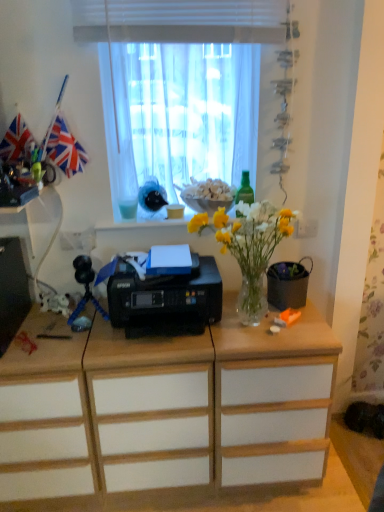
Question: Does white sheer curtain at upper center have a lesser height compared to red fabric flag at upper left?

Choices:
 (A) yes
 (B) no

Answer: (B)

Question: Is the depth of white sheer curtain at upper center greater than that of red fabric flag at upper left?

Choices:
 (A) yes
 (B) no

Answer: (B)

Question: From the image's perspective, is white sheer curtain at upper center under red fabric flag at upper left?

Choices:
 (A) no
 (B) yes

Answer: (A)

Question: Is white sheer curtain at upper center turned away from red fabric flag at upper left?

Choices:
 (A) no
 (B) yes

Answer: (A)

Question: Is white sheer curtain at upper center not inside red fabric flag at upper left?

Choices:
 (A) no
 (B) yes

Answer: (B)

Question: From a real-world perspective, is white sheer curtain at upper center located higher than red fabric flag at upper left?

Choices:
 (A) yes
 (B) no

Answer: (A)

Question: Is white matte drawer at center, placed as the second drawer when sorted from left to right, aimed at green glass bottle at upper center?

Choices:
 (A) no
 (B) yes

Answer: (A)

Question: From a real-world perspective, is white matte drawer at center, placed as the second drawer when sorted from left to right, located beneath green glass bottle at upper center?

Choices:
 (A) yes
 (B) no

Answer: (A)

Question: Does white matte drawer at center, the 1th drawer viewed from the right, have a smaller size compared to green glass bottle at upper center?

Choices:
 (A) yes
 (B) no

Answer: (B)

Question: Is white matte drawer at center, placed as the second drawer when sorted from left to right, to the right of green glass bottle at upper center from the viewer's perspective?

Choices:
 (A) no
 (B) yes

Answer: (A)

Question: Considering the relative positions of white matte drawer at center, the 1th drawer viewed from the right, and green glass bottle at upper center in the image provided, is white matte drawer at center, the 1th drawer viewed from the right, in front of green glass bottle at upper center?

Choices:
 (A) yes
 (B) no

Answer: (A)

Question: Is white matte drawer at center, the 1th drawer viewed from the right, far away from green glass bottle at upper center?

Choices:
 (A) no
 (B) yes

Answer: (A)

Question: Considering the relative sizes of white sheer curtain at upper center and green glass bottle at upper center in the image provided, is white sheer curtain at upper center thinner than green glass bottle at upper center?

Choices:
 (A) no
 (B) yes

Answer: (A)